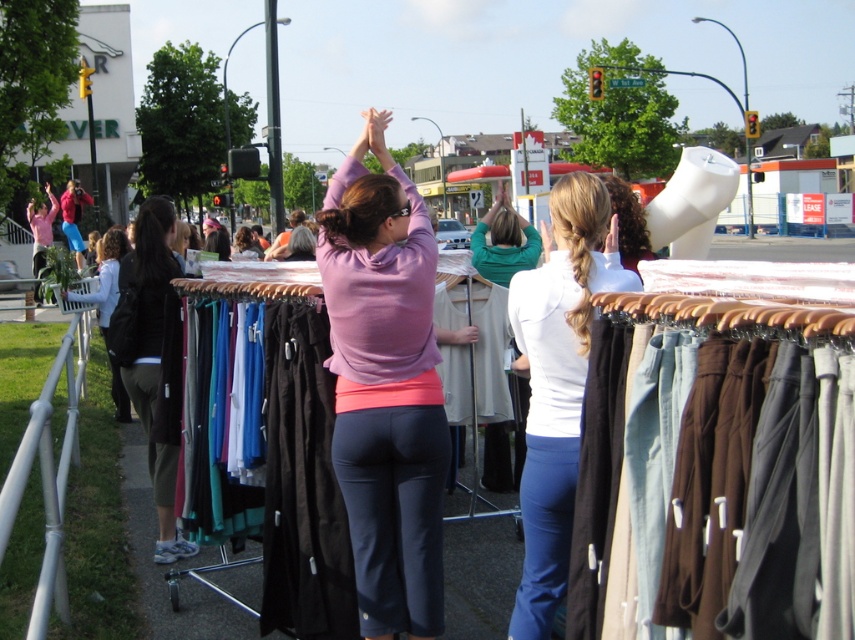
Question: Is white plastic chair at left to the right of matte blue jeans at center from the viewer's perspective?

Choices:
 (A) no
 (B) yes

Answer: (B)

Question: Is matte purple hoodie at center to the left of white plastic chair at left from the viewer's perspective?

Choices:
 (A) no
 (B) yes

Answer: (A)

Question: Which point is closer to the camera?

Choices:
 (A) matte pink sweater at upper center
 (B) white plastic chair at left
 (C) matte pink sweater at center
 (D) white matte shirt at center

Answer: (D)

Question: Considering the real-world distances, which object is farthest from the matte pink sweater at upper center?

Choices:
 (A) matte pink sweater at center
 (B) matte purple hoodie at center

Answer: (B)

Question: Does white matte shirt at center appear over matte pink sweater at upper center?

Choices:
 (A) yes
 (B) no

Answer: (B)

Question: Which object is positioned closest to the matte purple hoodie at center?

Choices:
 (A) matte pink sweater at upper center
 (B) dark brown leather jacket at left

Answer: (B)